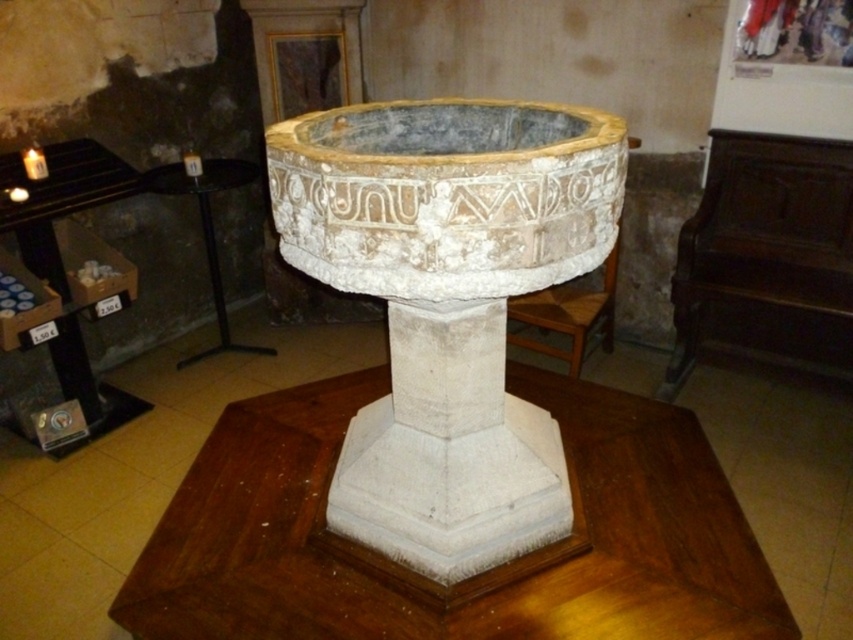
Is wooden table at center bigger than black wood table at left?

Correct, wooden table at center is larger in size than black wood table at left.

Does wooden table at center have a greater width compared to black wood table at left?

Yes, wooden table at center is wider than black wood table at left.

Is point (280, 636) farther from viewer compared to point (44, 205)?

No, (280, 636) is in front of (44, 205).

Where is `wooden table at center`? The width and height of the screenshot is (853, 640). wooden table at center is located at coordinates (473, 577).